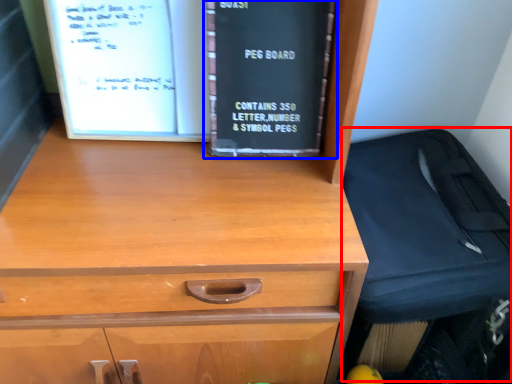
Question: Which point is further to the camera, luggage (highlighted by a red box) or book (highlighted by a blue box)?

Choices:
 (A) luggage
 (B) book

Answer: (B)